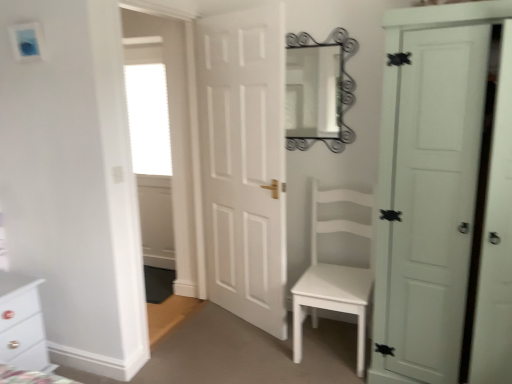
Question: Considering the relative sizes of white glossy chest of drawers at lower left and white matte door at center, the 1th door in the left-to-right sequence, in the image provided, is white glossy chest of drawers at lower left bigger than white matte door at center, the 1th door in the left-to-right sequence,?

Choices:
 (A) no
 (B) yes

Answer: (A)

Question: From a real-world perspective, is white glossy chest of drawers at lower left below white matte door at center, the 1th door in the left-to-right sequence?

Choices:
 (A) yes
 (B) no

Answer: (A)

Question: Is white glossy chest of drawers at lower left far away from white matte door at center, the 1th door in the left-to-right sequence?

Choices:
 (A) yes
 (B) no

Answer: (A)

Question: Does white glossy chest of drawers at lower left appear on the left side of white matte door at center, the 1th door in the left-to-right sequence?

Choices:
 (A) no
 (B) yes

Answer: (B)

Question: From a real-world perspective, is white glossy chest of drawers at lower left positioned over white matte door at center, the 1th door in the left-to-right sequence, based on gravity?

Choices:
 (A) yes
 (B) no

Answer: (B)

Question: Is white glossy chest of drawers at lower left beside white matte door at center, which appears as the second door when viewed from the right?

Choices:
 (A) no
 (B) yes

Answer: (A)

Question: Can you confirm if white matte door at center, the 1th door in the left-to-right sequence, is wider than white matte door at right, the 1th door positioned from the right?

Choices:
 (A) yes
 (B) no

Answer: (B)

Question: Could you tell me if white matte door at center, the 1th door in the left-to-right sequence, is turned towards white matte door at right, the 2th door from the left?

Choices:
 (A) yes
 (B) no

Answer: (B)

Question: Does white matte door at center, the 1th door in the left-to-right sequence, have a larger size compared to white matte door at right, the 2th door from the left?

Choices:
 (A) yes
 (B) no

Answer: (B)

Question: Does white matte door at center, which appears as the second door when viewed from the right, have a lesser width compared to white matte door at right, the 1th door positioned from the right?

Choices:
 (A) yes
 (B) no

Answer: (A)

Question: Considering the relative positions of white matte door at center, which appears as the second door when viewed from the right, and white matte door at right, the 2th door from the left, in the image provided, is white matte door at center, which appears as the second door when viewed from the right, in front of white matte door at right, the 2th door from the left,?

Choices:
 (A) no
 (B) yes

Answer: (A)

Question: Is white matte door at center, which appears as the second door when viewed from the right, with white matte door at right, the 1th door positioned from the right?

Choices:
 (A) yes
 (B) no

Answer: (B)

Question: Is white glossy chest of drawers at lower left to the left of metallic silver mirror at upper center from the viewer's perspective?

Choices:
 (A) no
 (B) yes

Answer: (B)